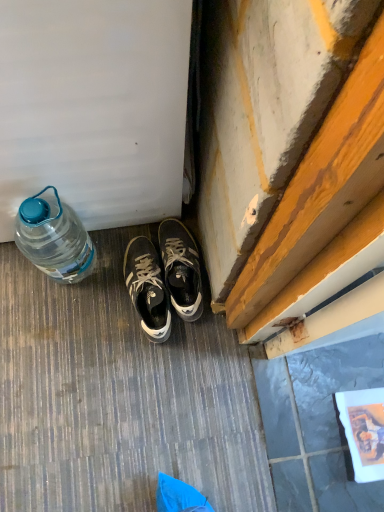
I want to click on matte black sneakers at center, positioned as the second sneakers in left-to-right order, so click(181, 268).

Image resolution: width=384 pixels, height=512 pixels. Describe the element at coordinates (54, 237) in the screenshot. I see `translucent plastic bottle at left` at that location.

What is the approximate height of dark gray leather sneakers at center, which appears as the 1th sneakers when viewed from the left?

dark gray leather sneakers at center, which appears as the 1th sneakers when viewed from the left, is 4.41 inches in height.

Locate an element on the screen. matte black sneakers at center, positioned as the second sneakers in left-to-right order is located at coordinates (181, 268).

From the image's perspective, is matte black sneakers at center, positioned as the second sneakers in left-to-right order, above or below dark gray leather sneakers at center, the 2th sneakers when ordered from right to left?

From the image's perspective, matte black sneakers at center, positioned as the second sneakers in left-to-right order, appears above dark gray leather sneakers at center, the 2th sneakers when ordered from right to left.

Between matte black sneakers at center, the first sneakers when ordered from right to left, and dark gray leather sneakers at center, the 2th sneakers when ordered from right to left, which one is positioned behind?

matte black sneakers at center, the first sneakers when ordered from right to left, is more distant.

Is matte black sneakers at center, the first sneakers when ordered from right to left, to the left of dark gray leather sneakers at center, the 2th sneakers when ordered from right to left, from the viewer's perspective?

No.

From a real-world perspective, does matte black sneakers at center, positioned as the second sneakers in left-to-right order, stand above dark gray leather sneakers at center, the 2th sneakers when ordered from right to left?

Indeed, from a real-world perspective, matte black sneakers at center, positioned as the second sneakers in left-to-right order, stands above dark gray leather sneakers at center, the 2th sneakers when ordered from right to left.

Is translucent plastic bottle at left thinner than matte black sneakers at center, positioned as the second sneakers in left-to-right order?

Indeed, translucent plastic bottle at left has a lesser width compared to matte black sneakers at center, positioned as the second sneakers in left-to-right order.

Are translucent plastic bottle at left and matte black sneakers at center, the first sneakers when ordered from right to left, far apart?

No, translucent plastic bottle at left is in close proximity to matte black sneakers at center, the first sneakers when ordered from right to left.

In the scene shown: From the image's perspective, relative to matte black sneakers at center, the first sneakers when ordered from right to left, is translucent plastic bottle at left above or below?

translucent plastic bottle at left is above matte black sneakers at center, the first sneakers when ordered from right to left.

Considering the relative positions of dark gray leather sneakers at center, which appears as the 1th sneakers when viewed from the left, and translucent plastic bottle at left in the image provided, is dark gray leather sneakers at center, which appears as the 1th sneakers when viewed from the left, to the right of translucent plastic bottle at left from the viewer's perspective?

Yes, dark gray leather sneakers at center, which appears as the 1th sneakers when viewed from the left, is to the right of translucent plastic bottle at left.

How far apart are dark gray leather sneakers at center, the 2th sneakers when ordered from right to left, and translucent plastic bottle at left?

A distance of 21.12 centimeters exists between dark gray leather sneakers at center, the 2th sneakers when ordered from right to left, and translucent plastic bottle at left.

Is dark gray leather sneakers at center, which appears as the 1th sneakers when viewed from the left, closer to camera compared to translucent plastic bottle at left?

No, dark gray leather sneakers at center, which appears as the 1th sneakers when viewed from the left, is further to the viewer.

Which is more to the right, translucent plastic bottle at left or dark gray leather sneakers at center, the 2th sneakers when ordered from right to left?

dark gray leather sneakers at center, the 2th sneakers when ordered from right to left.

Considering the sizes of objects translucent plastic bottle at left and dark gray leather sneakers at center, the 2th sneakers when ordered from right to left, in the image provided, who is wider, translucent plastic bottle at left or dark gray leather sneakers at center, the 2th sneakers when ordered from right to left,?

With larger width is dark gray leather sneakers at center, the 2th sneakers when ordered from right to left.

From the picture: Is dark gray leather sneakers at center, which appears as the 1th sneakers when viewed from the left, a part of translucent plastic bottle at left?

No, dark gray leather sneakers at center, which appears as the 1th sneakers when viewed from the left, is not surrounded by translucent plastic bottle at left.

Is the position of translucent plastic bottle at left more distant than that of dark gray leather sneakers at center, the 2th sneakers when ordered from right to left?

No, translucent plastic bottle at left is closer to the camera.

Is matte black sneakers at center, the first sneakers when ordered from right to left, facing away from translucent plastic bottle at left?

No, matte black sneakers at center, the first sneakers when ordered from right to left, is not facing away from translucent plastic bottle at left.

Can you confirm if matte black sneakers at center, positioned as the second sneakers in left-to-right order, is thinner than translucent plastic bottle at left?

No, matte black sneakers at center, positioned as the second sneakers in left-to-right order, is not thinner than translucent plastic bottle at left.

Does matte black sneakers at center, positioned as the second sneakers in left-to-right order, lie in front of translucent plastic bottle at left?

No, the depth of matte black sneakers at center, positioned as the second sneakers in left-to-right order, is greater than that of translucent plastic bottle at left.

Can you confirm if matte black sneakers at center, positioned as the second sneakers in left-to-right order, is smaller than translucent plastic bottle at left?

Indeed, matte black sneakers at center, positioned as the second sneakers in left-to-right order, has a smaller size compared to translucent plastic bottle at left.

Which point is more distant from viewer, (165, 312) or (202, 305)?

Point (202, 305)

From a real-world perspective, who is located lower, dark gray leather sneakers at center, the 2th sneakers when ordered from right to left, or matte black sneakers at center, the first sneakers when ordered from right to left?

dark gray leather sneakers at center, the 2th sneakers when ordered from right to left.

From the image's perspective, is dark gray leather sneakers at center, which appears as the 1th sneakers when viewed from the left, below matte black sneakers at center, the first sneakers when ordered from right to left?

Yes, from the image's perspective, dark gray leather sneakers at center, which appears as the 1th sneakers when viewed from the left, is beneath matte black sneakers at center, the first sneakers when ordered from right to left.

Locate an element on the screen. The height and width of the screenshot is (512, 384). sneakers lying above the dark gray leather sneakers at center, the 2th sneakers when ordered from right to left (from the image's perspective) is located at coordinates (181, 268).

In the image, there is a dark gray leather sneakers at center, the 2th sneakers when ordered from right to left. What are the coordinates of `sneakers above it (from the image's perspective)` in the screenshot? It's located at (181, 268).

Where is `bottle on the left of matte black sneakers at center, positioned as the second sneakers in left-to-right order`? Image resolution: width=384 pixels, height=512 pixels. bottle on the left of matte black sneakers at center, positioned as the second sneakers in left-to-right order is located at coordinates (54, 237).

From the image, which object appears to be nearer to dark gray leather sneakers at center, the 2th sneakers when ordered from right to left, matte black sneakers at center, positioned as the second sneakers in left-to-right order, or translucent plastic bottle at left?

matte black sneakers at center, positioned as the second sneakers in left-to-right order, lies closer to dark gray leather sneakers at center, the 2th sneakers when ordered from right to left, than the other object.

Based on their spatial positions, is matte black sneakers at center, positioned as the second sneakers in left-to-right order, or dark gray leather sneakers at center, the 2th sneakers when ordered from right to left, closer to translucent plastic bottle at left?

dark gray leather sneakers at center, the 2th sneakers when ordered from right to left, is closer to translucent plastic bottle at left.

Estimate the real-world distances between objects in this image. Which object is closer to dark gray leather sneakers at center, the 2th sneakers when ordered from right to left, translucent plastic bottle at left or matte black sneakers at center, the first sneakers when ordered from right to left?

The object closer to dark gray leather sneakers at center, the 2th sneakers when ordered from right to left, is matte black sneakers at center, the first sneakers when ordered from right to left.

Estimate the real-world distances between objects in this image. Which object is further from matte black sneakers at center, the first sneakers when ordered from right to left, dark gray leather sneakers at center, the 2th sneakers when ordered from right to left, or translucent plastic bottle at left?

translucent plastic bottle at left is further to matte black sneakers at center, the first sneakers when ordered from right to left.

In the scene shown: Looking at the image, which one is located further to matte black sneakers at center, the first sneakers when ordered from right to left, translucent plastic bottle at left or dark gray leather sneakers at center, which appears as the 1th sneakers when viewed from the left?

translucent plastic bottle at left lies further to matte black sneakers at center, the first sneakers when ordered from right to left, than the other object.

Considering their positions, is dark gray leather sneakers at center, which appears as the 1th sneakers when viewed from the left, positioned closer to translucent plastic bottle at left than matte black sneakers at center, positioned as the second sneakers in left-to-right order?

dark gray leather sneakers at center, which appears as the 1th sneakers when viewed from the left, lies closer to translucent plastic bottle at left than the other object.

You are a GUI agent. You are given a task and a screenshot of the screen. Output one action in this format:
    pyautogui.click(x=<x>, y=<y>)
    Task: Click on the sneakers between translucent plastic bottle at left and matte black sneakers at center, the first sneakers when ordered from right to left, in the horizontal direction
    
    Given the screenshot: What is the action you would take?
    pyautogui.click(x=147, y=288)